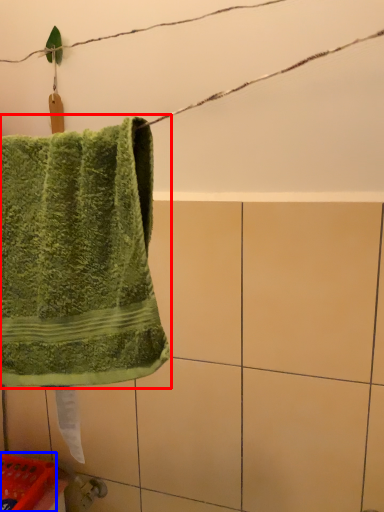
Question: Among these objects, which one is farthest to the camera, towel (highlighted by a red box) or basket (highlighted by a blue box)?

Choices:
 (A) towel
 (B) basket

Answer: (B)